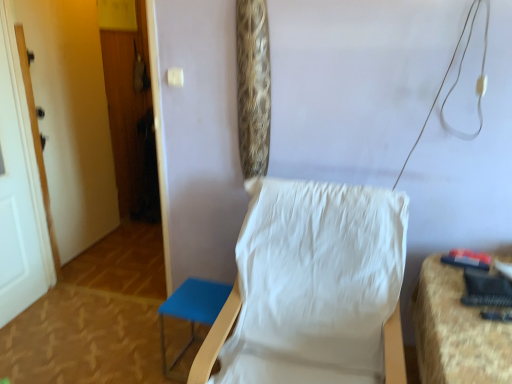
What is the approximate width of white painted wood door at left, the 2th door in the front-to-back sequence?

It is 4.20 inches.

Identify the location of leopard print fabric at upper center. This screenshot has height=384, width=512. (253, 86).

Image resolution: width=512 pixels, height=384 pixels. I want to click on blue fabric stool at lower left, which is the second furniture from right to left, so click(x=192, y=312).

Between white painted wood door at left, which ranks as the first door in back-to-front order, and white painted wood door at left, the 2th door in the back-to-front sequence, which one appears on the left side from the viewer's perspective?

white painted wood door at left, the 2th door in the back-to-front sequence.

Based on the photo, from the image's perspective, between white painted wood door at left, the 2th door in the front-to-back sequence, and white painted wood door at left, the 2th door in the back-to-front sequence, which one is located above?

white painted wood door at left, the 2th door in the front-to-back sequence, from the image's perspective.

Considering the sizes of objects white painted wood door at left, which ranks as the first door in back-to-front order, and white painted wood door at left, the 2th door in the back-to-front sequence, in the image provided, who is taller, white painted wood door at left, which ranks as the first door in back-to-front order, or white painted wood door at left, the 2th door in the back-to-front sequence,?

white painted wood door at left, the 2th door in the back-to-front sequence, is taller.

Does point (86, 213) appear closer or farther from the camera than point (6, 223)?

Point (86, 213) appears to be farther away from the viewer than point (6, 223).

Is white painted wood door at left, the 2th door in the front-to-back sequence, wider or thinner than white fabric chair at center?

Clearly, white painted wood door at left, the 2th door in the front-to-back sequence, has less width compared to white fabric chair at center.

Is white painted wood door at left, which ranks as the first door in back-to-front order, far away from white fabric chair at center?

white painted wood door at left, which ranks as the first door in back-to-front order, is positioned a significant distance from white fabric chair at center.

Looking at this image, is white painted wood door at left, the 2th door in the front-to-back sequence, to the left of white fabric chair at center from the viewer's perspective?

Yes, white painted wood door at left, the 2th door in the front-to-back sequence, is to the left of white fabric chair at center.

Locate an element on the screen. This screenshot has width=512, height=384. the 1st door counting from the left side of the white fabric chair at center is located at coordinates (72, 118).

Can you confirm if white painted wood door at left, acting as the 1th door starting from the front, is taller than leopard print fabric at upper center?

Yes.

From the image's perspective, which is above, white painted wood door at left, acting as the 1th door starting from the front, or leopard print fabric at upper center?

leopard print fabric at upper center.

Between white painted wood door at left, the 2th door in the back-to-front sequence, and leopard print fabric at upper center, which one has larger size?

Bigger between the two is white painted wood door at left, the 2th door in the back-to-front sequence.

Considering the relative sizes of leopard print fabric at upper center and blue fabric stool at lower left, which is the second furniture from right to left, in the image provided, is leopard print fabric at upper center taller than blue fabric stool at lower left, which is the second furniture from right to left,?

Correct, leopard print fabric at upper center is much taller as blue fabric stool at lower left, which is the second furniture from right to left.

Is leopard print fabric at upper center bigger than blue fabric stool at lower left, the 1th furniture viewed from the left?

No.

Is leopard print fabric at upper center beside blue fabric stool at lower left, the 1th furniture viewed from the left?

No, leopard print fabric at upper center is not with blue fabric stool at lower left, the 1th furniture viewed from the left.

Consider the image. Could you tell me if leopard print fabric at upper center is turned towards blue fabric stool at lower left, the 1th furniture viewed from the left?

No, leopard print fabric at upper center does not turn towards blue fabric stool at lower left, the 1th furniture viewed from the left.

Is leopard print fabric at upper center completely or partially inside blue fabric stool at lower left, which is the second furniture from right to left?

No, leopard print fabric at upper center is located outside of blue fabric stool at lower left, which is the second furniture from right to left.

Does blue fabric stool at lower left, which is the second furniture from right to left, come in front of leopard print fabric at upper center?

No, blue fabric stool at lower left, which is the second furniture from right to left, is behind leopard print fabric at upper center.

Which is more to the left, blue fabric stool at lower left, which is the second furniture from right to left, or leopard print fabric at upper center?

blue fabric stool at lower left, which is the second furniture from right to left.

From the image's perspective, which one is positioned higher, blue fabric stool at lower left, the 1th furniture viewed from the left, or leopard print fabric at upper center?

From the image's view, leopard print fabric at upper center is above.

Is white painted wood door at left, the 2th door in the back-to-front sequence, aimed at white fabric chair at center?

Yes, white painted wood door at left, the 2th door in the back-to-front sequence, is turned towards white fabric chair at center.

In the image, is white painted wood door at left, the 2th door in the back-to-front sequence, on the left side or the right side of white fabric chair at center?

From the image, it's evident that white painted wood door at left, the 2th door in the back-to-front sequence, is to the left of white fabric chair at center.

From a real-world perspective, is white painted wood door at left, the 2th door in the back-to-front sequence, physically located above or below white fabric chair at center?

white painted wood door at left, the 2th door in the back-to-front sequence, is above white fabric chair at center.

From the image's perspective, is white painted wood door at left, the 2th door in the back-to-front sequence, located beneath white fabric chair at center?

Actually, white painted wood door at left, the 2th door in the back-to-front sequence, appears above white fabric chair at center in the image.

You are a GUI agent. You are given a task and a screenshot of the screen. Output one action in this format:
    pyautogui.click(x=<x>, y=<y>)
    Task: Click on the 1st door below the leopard print fabric at upper center (from the image's perspective)
    
    Given the screenshot: What is the action you would take?
    pyautogui.click(x=72, y=118)

Are leopard print fabric at upper center and white painted wood door at left, the 2th door in the front-to-back sequence, located far from each other?

Yes, leopard print fabric at upper center and white painted wood door at left, the 2th door in the front-to-back sequence, are quite far apart.

Locate an element on the screen. The height and width of the screenshot is (384, 512). door positioned vertically above the white painted wood door at left, which ranks as the first door in back-to-front order (from a real-world perspective) is located at coordinates (19, 192).

Locate an element on the screen. the 2nd door behind the white fabric chair at center, counting from the anchor's position is located at coordinates [x=72, y=118].

Consider the image. Looking at the image, which one is located closer to white painted wood door at left, the 2th door in the back-to-front sequence, leopard print fabric at upper center or blue fabric stool at lower left, which is the second furniture from right to left?

blue fabric stool at lower left, which is the second furniture from right to left, is positioned closer to the anchor white painted wood door at left, the 2th door in the back-to-front sequence.

From the image, which object appears to be nearer to textured fabric chair at right, which is the 2th furniture from left to right, white painted wood door at left, the 2th door in the back-to-front sequence, or white painted wood door at left, the 2th door in the front-to-back sequence?

white painted wood door at left, the 2th door in the back-to-front sequence, is closer to textured fabric chair at right, which is the 2th furniture from left to right.

Considering their positions, is white painted wood door at left, which ranks as the first door in back-to-front order, positioned closer to leopard print fabric at upper center than textured fabric chair at right, which is the 2th furniture from left to right?

Based on the image, textured fabric chair at right, which is the 2th furniture from left to right, appears to be nearer to leopard print fabric at upper center.

Looking at the image, which one is located further to white painted wood door at left, which ranks as the first door in back-to-front order, blue fabric stool at lower left, which is the second furniture from right to left, or white fabric chair at center?

The object further to white painted wood door at left, which ranks as the first door in back-to-front order, is white fabric chair at center.

Which object lies further to the anchor point leopard print fabric at upper center, white painted wood door at left, acting as the 1th door starting from the front, or blue fabric stool at lower left, which is the second furniture from right to left?

white painted wood door at left, acting as the 1th door starting from the front, is further to leopard print fabric at upper center.

Based on their spatial positions, is leopard print fabric at upper center or white painted wood door at left, the 2th door in the back-to-front sequence, further from textured fabric chair at right, which is the 2th furniture from left to right?

The object further to textured fabric chair at right, which is the 2th furniture from left to right, is white painted wood door at left, the 2th door in the back-to-front sequence.

When comparing their distances from white painted wood door at left, the 2th door in the back-to-front sequence, does leopard print fabric at upper center or white painted wood door at left, the 2th door in the front-to-back sequence, seem closer?

white painted wood door at left, the 2th door in the front-to-back sequence, is closer to white painted wood door at left, the 2th door in the back-to-front sequence.

When comparing their distances from leopard print fabric at upper center, does white fabric chair at center or white painted wood door at left, the 2th door in the back-to-front sequence, seem further?

white painted wood door at left, the 2th door in the back-to-front sequence, is positioned further to the anchor leopard print fabric at upper center.

Identify the location of furniture between white painted wood door at left, the 2th door in the back-to-front sequence, and white fabric chair at center from left to right. The height and width of the screenshot is (384, 512). (192, 312).

The height and width of the screenshot is (384, 512). Identify the location of chair between leopard print fabric at upper center and textured fabric chair at right, which is the 2th furniture from left to right, in the vertical direction. (312, 285).

Identify the location of chair between white painted wood door at left, acting as the 1th door starting from the front, and textured fabric chair at right, placed as the 1th furniture when sorted from right to left, from left to right. This screenshot has height=384, width=512. (312, 285).

Find the location of a particular element. curtain between white painted wood door at left, which ranks as the first door in back-to-front order, and white fabric chair at center from left to right is located at coordinates (253, 86).